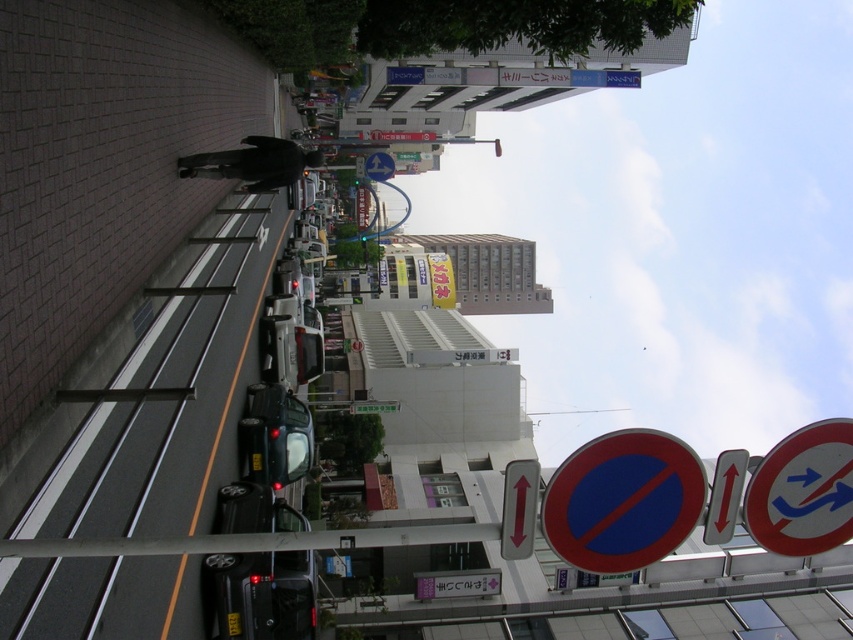
Based on the photo, is smooth plastic circle at center thinner than red plastic arrow at center?

Incorrect, smooth plastic circle at center's width is not less than red plastic arrow at center's.

Which is more to the left, smooth plastic circle at center or red plastic arrow at center?

red plastic arrow at center is more to the left.

Find the location of a particular element. smooth plastic circle at center is located at coordinates (624, 500).

What do you see at coordinates (519, 508) in the screenshot?
I see `red plastic arrow at center` at bounding box center [519, 508].

The image size is (853, 640). Find the location of `red plastic arrow at center`. red plastic arrow at center is located at coordinates (519, 508).

Find the location of `red plastic arrow at center`. red plastic arrow at center is located at coordinates (519, 508).

Is smooth plastic circle at center shorter than matte blue arrow at center?

Correct, smooth plastic circle at center is not as tall as matte blue arrow at center.

Is point (618, 490) closer to viewer compared to point (387, 157)?

That is True.

The width and height of the screenshot is (853, 640). Identify the location of smooth plastic circle at center. (624, 500).